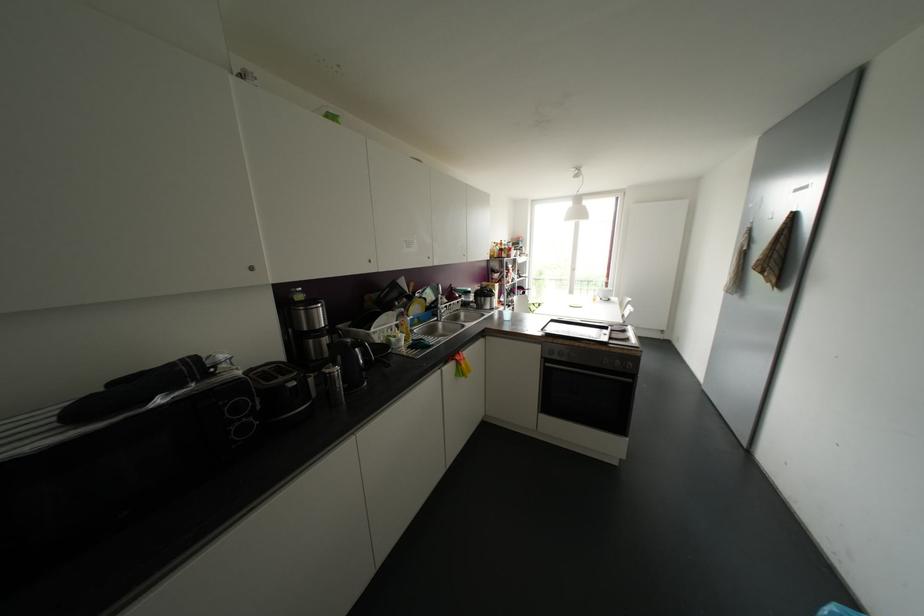
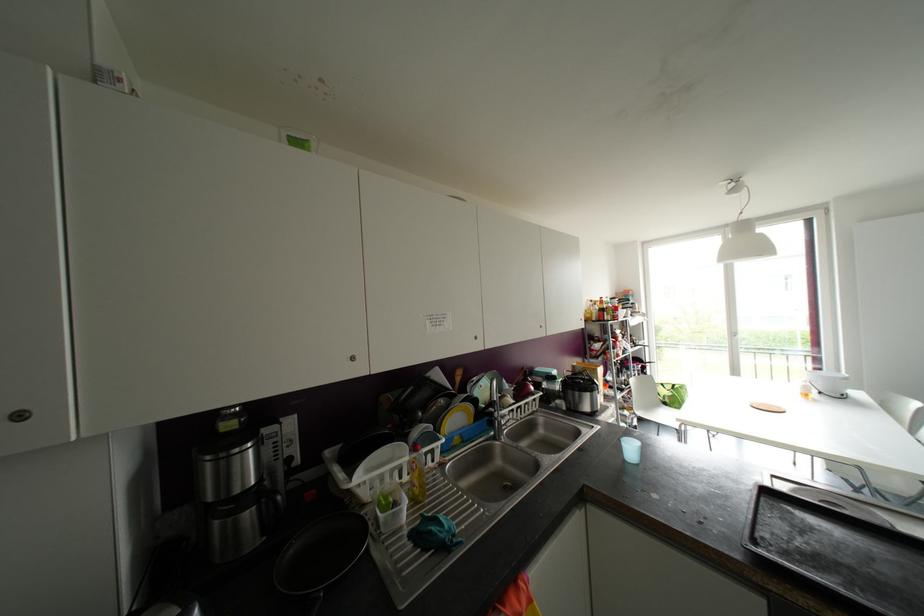
Locate, in the second image, the point that corresponds to pixel 440 310 in the first image.

(499, 422)